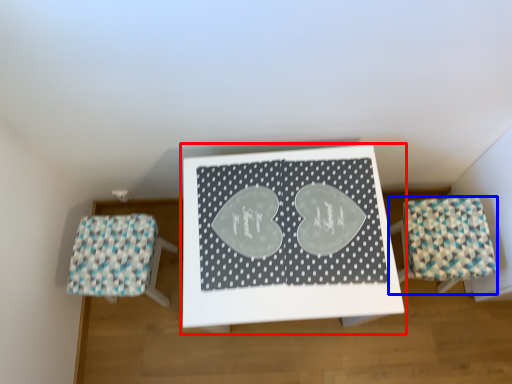
Question: Which object is closer to the camera taking this photo, table (highlighted by a red box) or furniture (highlighted by a blue box)?

Choices:
 (A) table
 (B) furniture

Answer: (A)